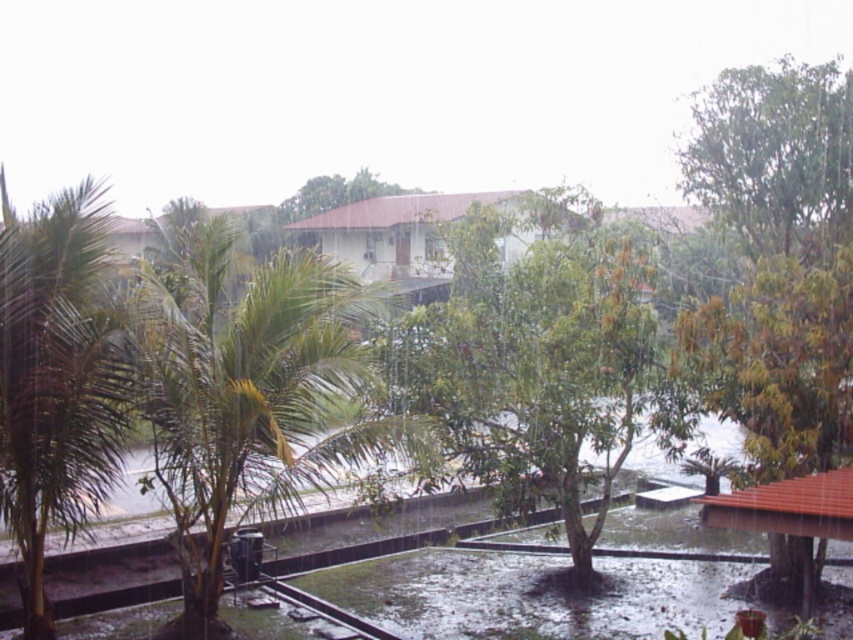
Question: Can you confirm if green leafy palm tree at center is positioned above green leafy palm tree at left?

Choices:
 (A) no
 (B) yes

Answer: (B)

Question: Considering the real-world distances, which object is closest to the green leafy tree at center?

Choices:
 (A) green leafy palm tree at left
 (B) green leafy palm tree at center

Answer: (B)

Question: Based on their relative distances, which object is nearer to the green leafy palm tree at center?

Choices:
 (A) green leafy palm tree at left
 (B) green leafy tree at center

Answer: (A)

Question: Is green leafy palm tree at center positioned at the back of green leafy tree at center?

Choices:
 (A) yes
 (B) no

Answer: (B)

Question: In this image, where is green leafy palm tree at center located relative to green leafy palm tree at left?

Choices:
 (A) right
 (B) left

Answer: (B)

Question: Estimate the real-world distances between objects in this image. Which object is farther from the green leafy palm tree at center?

Choices:
 (A) green leafy palm tree at left
 (B) green leafy tree at center

Answer: (B)